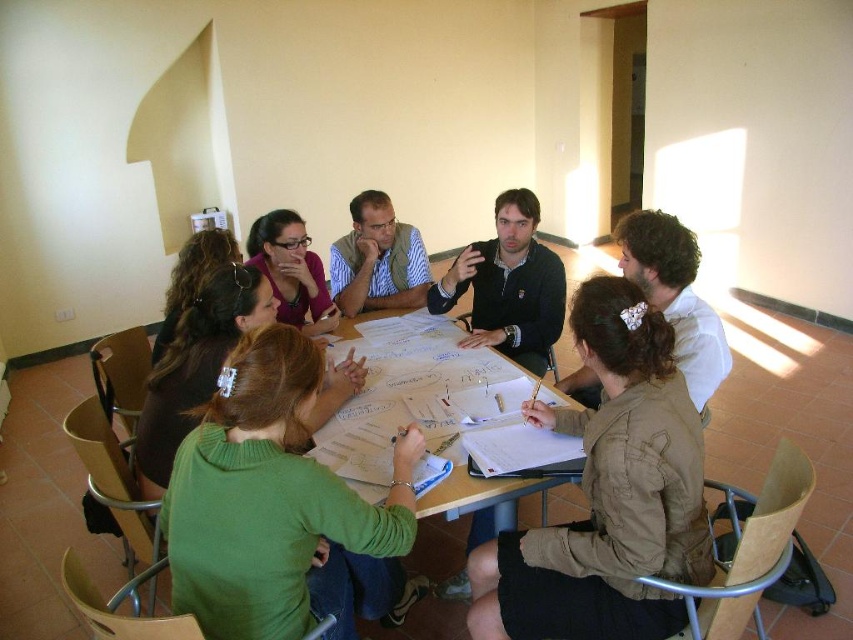
Question: Estimate the real-world distances between objects in this image. Which object is farther from the white paper at center?

Choices:
 (A) striped fabric shirt at center
 (B) green sweater at center

Answer: (A)

Question: Is green sweater at center behind striped fabric shirt at center?

Choices:
 (A) no
 (B) yes

Answer: (A)

Question: Does green sweater at center come in front of striped fabric shirt at center?

Choices:
 (A) yes
 (B) no

Answer: (A)

Question: Which of the following is the farthest from the observer?

Choices:
 (A) (448, 516)
 (B) (346, 307)

Answer: (B)

Question: Does green sweater at center have a lesser width compared to white paper at center?

Choices:
 (A) no
 (B) yes

Answer: (B)

Question: Which object is closer to the camera taking this photo?

Choices:
 (A) white paper at center
 (B) green sweater at center
 (C) brown quilted jacket at center
 (D) striped fabric shirt at center

Answer: (B)